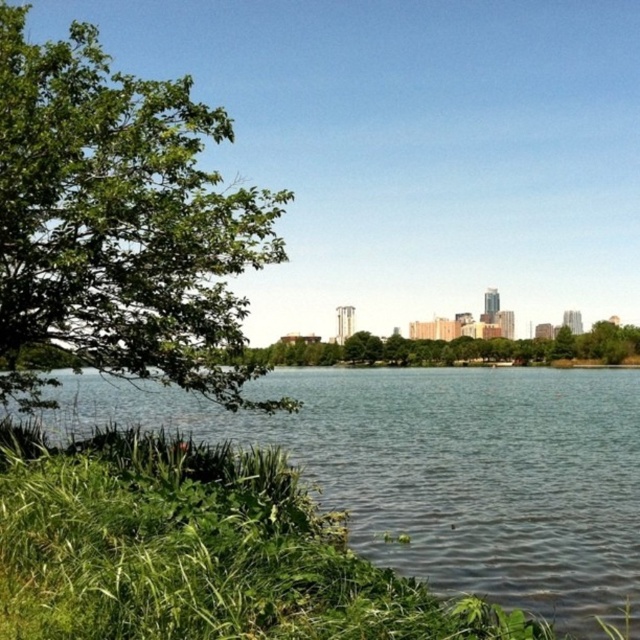
Does green liquid water at lower left lie in front of green leafy tree at left?

Yes, green liquid water at lower left is closer to the viewer.

Between green liquid water at lower left and green leafy tree at left, which one appears on the left side from the viewer's perspective?

green leafy tree at left

In order to click on green liquid water at lower left in this screenshot , I will do `click(445, 468)`.

What are the coordinates of `green liquid water at lower left` in the screenshot? It's located at (445, 468).